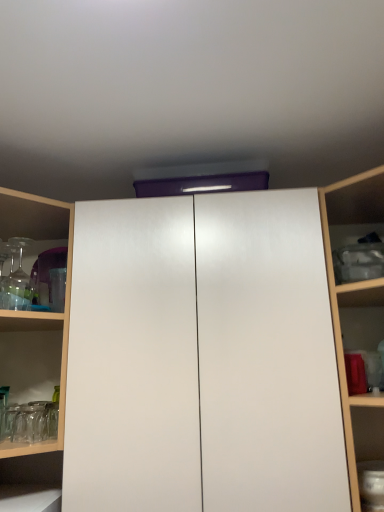
Question: Considering the positions of clear glassware at left and white glossy cupboard at center in the image, is clear glassware at left taller or shorter than white glossy cupboard at center?

Choices:
 (A) short
 (B) tall

Answer: (A)

Question: From the image's perspective, is clear glassware at left above or below white glossy cupboard at center?

Choices:
 (A) above
 (B) below

Answer: (A)

Question: Is clear glassware at left wider or thinner than white glossy cupboard at center?

Choices:
 (A) thin
 (B) wide

Answer: (B)

Question: Which is correct: white glossy cupboard at center is inside clear glassware at left, or outside of it?

Choices:
 (A) outside
 (B) inside

Answer: (A)

Question: In terms of height, does white glossy cupboard at center look taller or shorter compared to clear glassware at left?

Choices:
 (A) tall
 (B) short

Answer: (A)

Question: Is white glossy cupboard at center to the left or to the right of clear glassware at left in the image?

Choices:
 (A) left
 (B) right

Answer: (B)

Question: Is white glossy cupboard at center in front of or behind clear glassware at left in the image?

Choices:
 (A) behind
 (B) front

Answer: (B)